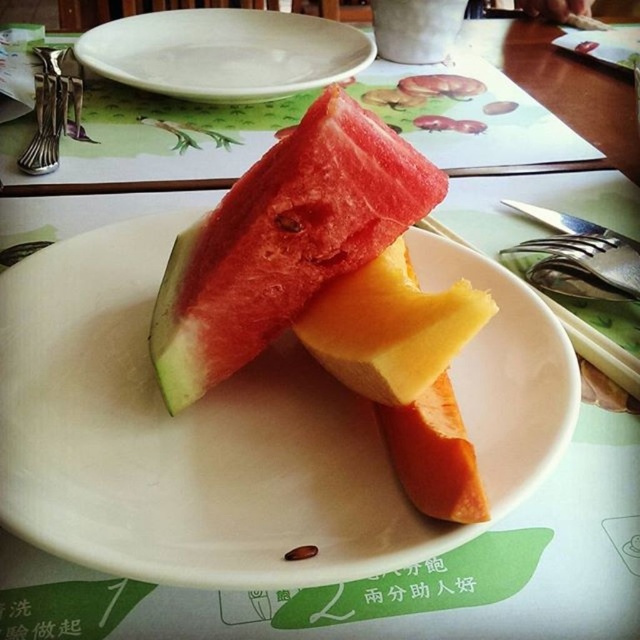
Question: Observing the image, what is the correct spatial positioning of white glossy plate at center in reference to orange smooth carrot at center?

Choices:
 (A) right
 (B) left

Answer: (B)

Question: Which point is closer to the camera?

Choices:
 (A) (259, 83)
 (B) (420, 499)
 (C) (349, 179)
 (D) (45, 141)

Answer: (B)

Question: Is red matte watermelon at center positioned before yellow smooth melon at center?

Choices:
 (A) no
 (B) yes

Answer: (A)

Question: Which object is farther from the camera taking this photo?

Choices:
 (A) white ceramic plate at upper center
 (B) yellow smooth melon at center
 (C) orange smooth carrot at center

Answer: (A)

Question: Is the position of red matte watermelon at center less distant than that of orange smooth carrot at center?

Choices:
 (A) yes
 (B) no

Answer: (B)

Question: Which point is closer to the camera?

Choices:
 (A) yellow smooth melon at center
 (B) red matte watermelon at center

Answer: (A)